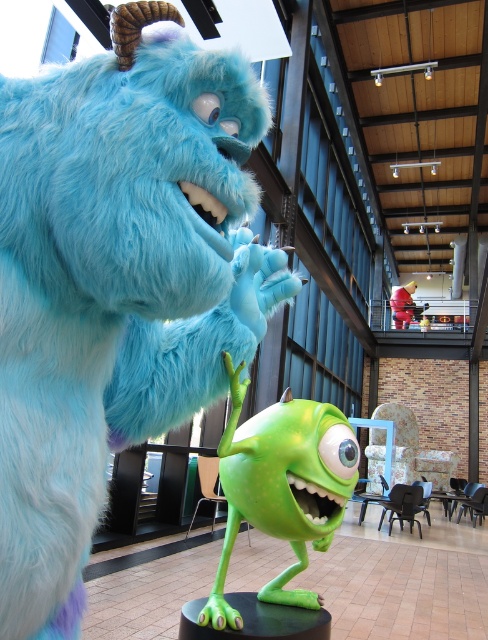
You are a photographer trying to capture both the fluffy blue fur at center and the green rubbery mike at center in a single shot. Based on their sizes, which one should you focus on first to ensure both fit in the frame?

The fluffy blue fur at center is smaller than the green rubbery mike at center, so you should focus on the green rubbery mike at center first to ensure both fit in the frame since it takes up more space.